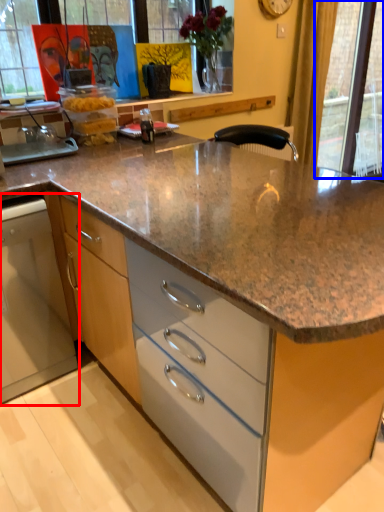
Question: Among these objects, which one is nearest to the camera, home appliance (highlighted by a red box) or glass door (highlighted by a blue box)?

Choices:
 (A) home appliance
 (B) glass door

Answer: (A)